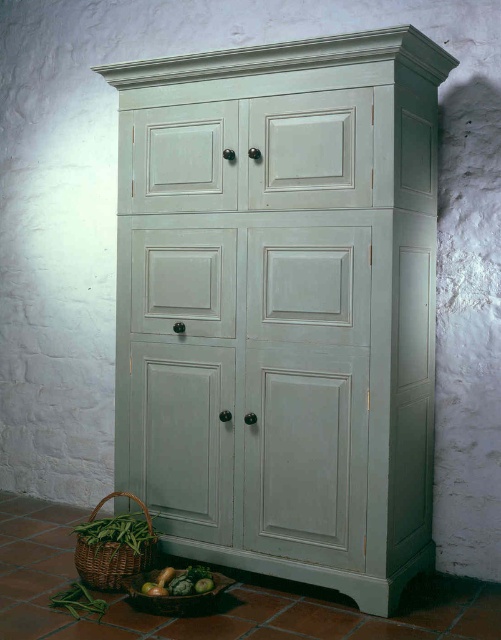
Is the position of green matte beans at lower left more distant than that of green matte cucumber at lower center?

Yes, green matte beans at lower left is behind green matte cucumber at lower center.

Is the position of green matte beans at lower left less distant than that of green matte cucumber at lower center?

No.

Locate an element on the screen. green matte beans at lower left is located at coordinates (x=117, y=532).

Find the location of `green matte vegetable at lower left`. green matte vegetable at lower left is located at coordinates (179, 582).

Is green matte vegetable at lower left above green matte cucumber at lower left?

Correct, green matte vegetable at lower left is located above green matte cucumber at lower left.

Where is `green matte vegetable at lower left`? The image size is (501, 640). green matte vegetable at lower left is located at coordinates (179, 582).

Is green matte vegetable at lower left below green matte cucumber at lower center?

Actually, green matte vegetable at lower left is above green matte cucumber at lower center.

What do you see at coordinates (179, 582) in the screenshot? The width and height of the screenshot is (501, 640). I see `green matte vegetable at lower left` at bounding box center [179, 582].

The width and height of the screenshot is (501, 640). Identify the location of green matte vegetable at lower left. (179, 582).